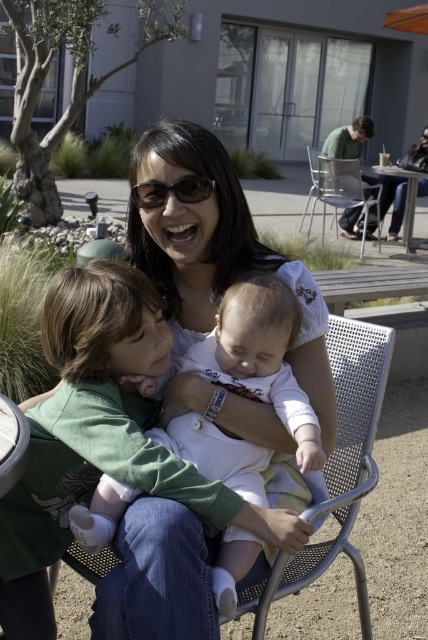
You are a photographer trying to capture a photo of the metallic silver chair at upper center and the matte black sunglasses at center. You need to know which object is wider to frame your shot properly. Which one is wider?

The metallic silver chair at upper center is wider than the matte black sunglasses at center according to the description.

You are a photographer trying to capture a candid shot of the matte black sunglasses at center without including the metallic silver chair at upper center in the frame. Is this possible given their positions?

The metallic silver chair at upper center is positioned over matte black sunglasses at center, so it would block the view of the sunglasses. Therefore, it is not possible to capture the matte black sunglasses at center without including the metallic silver chair at upper center in the frame.

Consider the image. You are a photographer trying to capture a closeup of the white matte baby at center while also including the matte black sunglasses at center in the frame. Can you focus on both objects at the same time?

→ The white matte baby at center is closer to the viewer than the matte black sunglasses at center. Since they are at different distances, it will be difficult to focus on both objects simultaneously in a single photo.